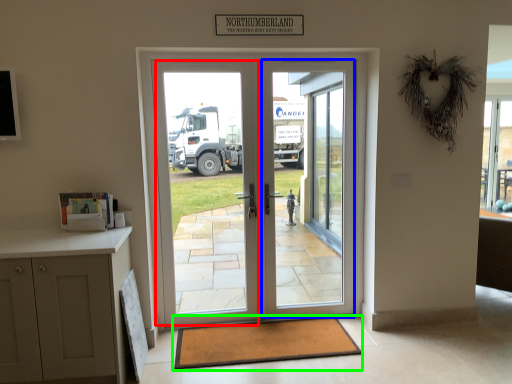
Question: Estimate the real-world distances between objects in this image. Which object is farther from screen door (highlighted by a red box), screen door (highlighted by a blue box) or mat (highlighted by a green box)?

Choices:
 (A) screen door
 (B) mat

Answer: (B)